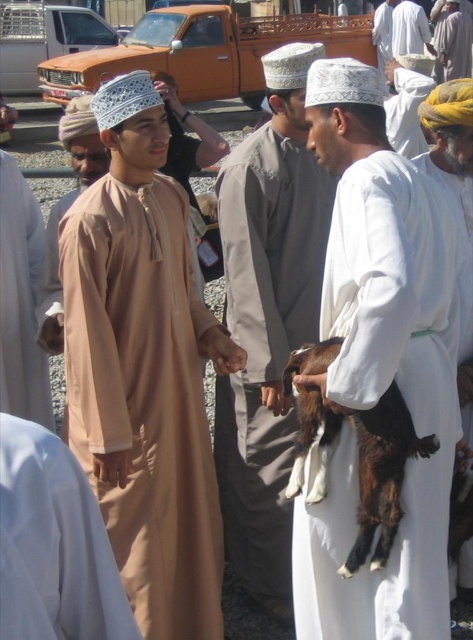
Measure the distance between point (35, 342) and camera.

4.32 meters

Is beige cotton robe at center in front of white cotton robe at center?

Yes, beige cotton robe at center is closer to the viewer.

You are a GUI agent. You are given a task and a screenshot of the screen. Output one action in this format:
    pyautogui.click(x=<x>, y=<y>)
    Task: Click on the beige cotton robe at center
    This screenshot has height=640, width=473.
    Given the screenshot: What is the action you would take?
    pyautogui.click(x=20, y=300)

Is point (7, 179) positioned in front of point (411, 144)?

That is True.

Does beige cotton robe at center have a greater height compared to white cotton turban at upper right?

Yes, beige cotton robe at center is taller than white cotton turban at upper right.

Where is `beige cotton robe at center`? The height and width of the screenshot is (640, 473). beige cotton robe at center is located at coordinates (20, 300).

At what (x,y) coordinates should I click in order to perform the action: click on beige cotton robe at center. Please return your answer as a coordinate pair (x, y). This screenshot has height=640, width=473. Looking at the image, I should click on (20, 300).

Does white matte goat at center appear on the right side of brown furry goat at center?

Correct, you'll find white matte goat at center to the right of brown furry goat at center.

Is white matte goat at center thinner than brown furry goat at center?

Incorrect, white matte goat at center's width is not less than brown furry goat at center's.

Locate an element on the screen. white matte goat at center is located at coordinates (379, 365).

Where is `white matte goat at center`? This screenshot has height=640, width=473. white matte goat at center is located at coordinates (379, 365).